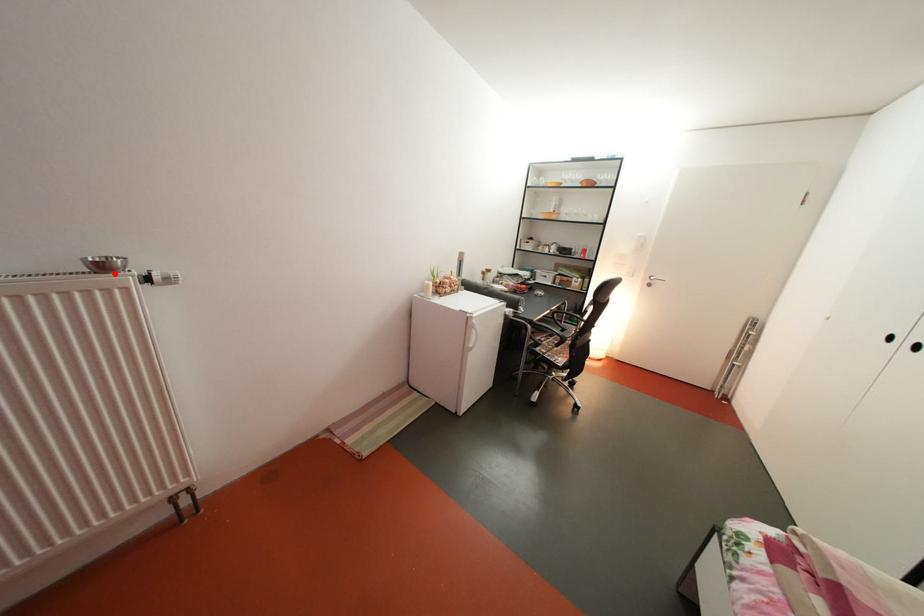
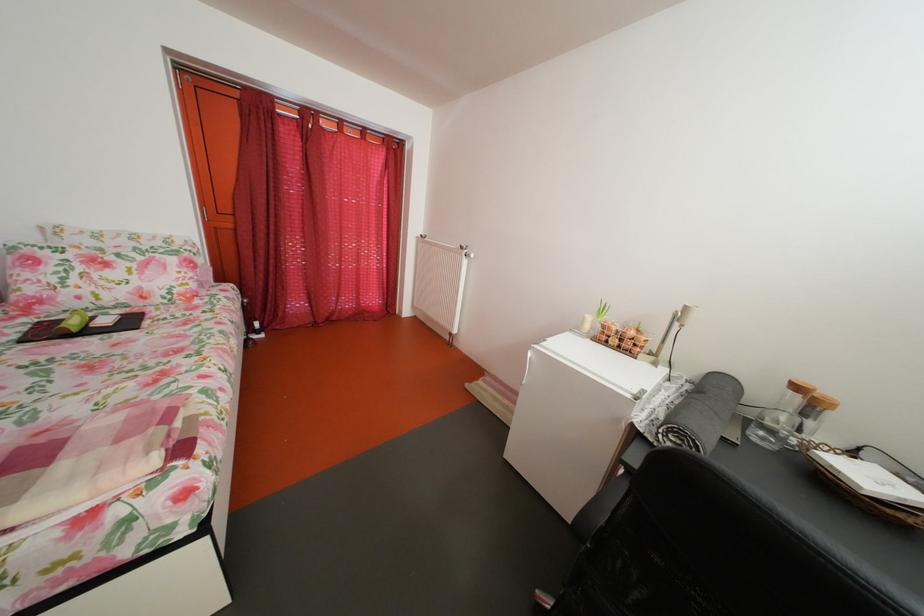
Locate, in the second image, the point that corresponds to the highlighted location in the first image.

(473, 254)